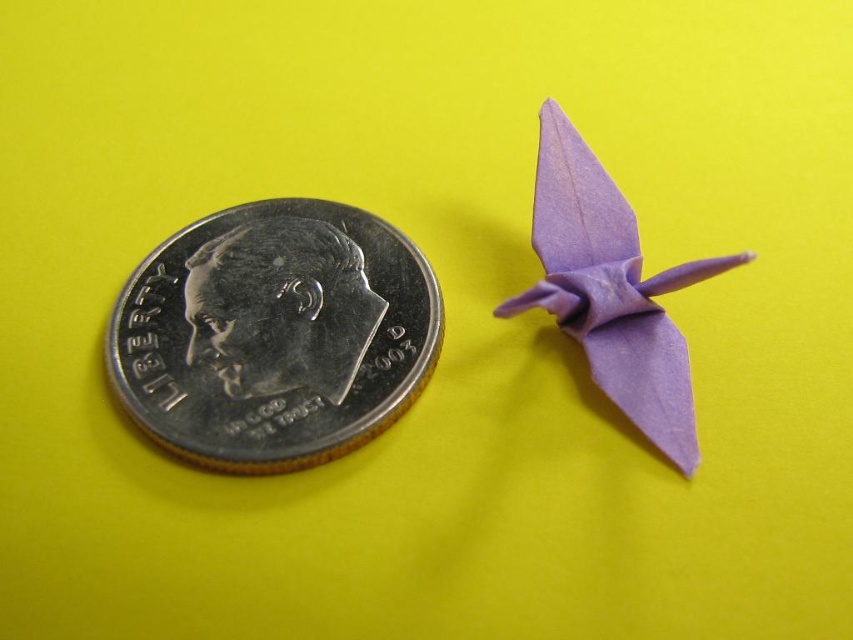
Question: Is silver/dull metal coin at left above lavender paper bird at upper right?

Choices:
 (A) no
 (B) yes

Answer: (A)

Question: Is silver/dull metal coin at left to the left of lavender paper bird at upper right from the viewer's perspective?

Choices:
 (A) yes
 (B) no

Answer: (A)

Question: Does silver/dull metal coin at left have a larger size compared to lavender paper bird at upper right?

Choices:
 (A) no
 (B) yes

Answer: (B)